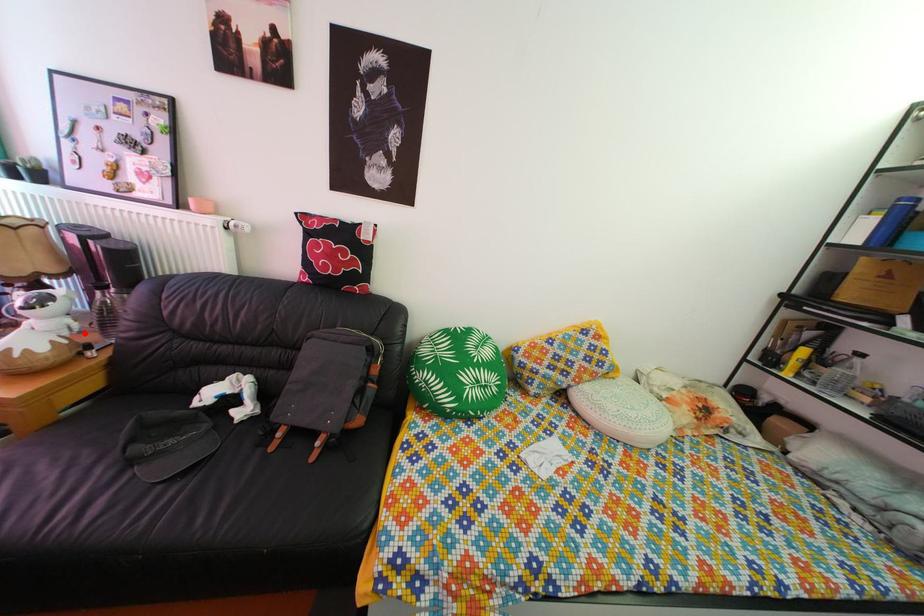
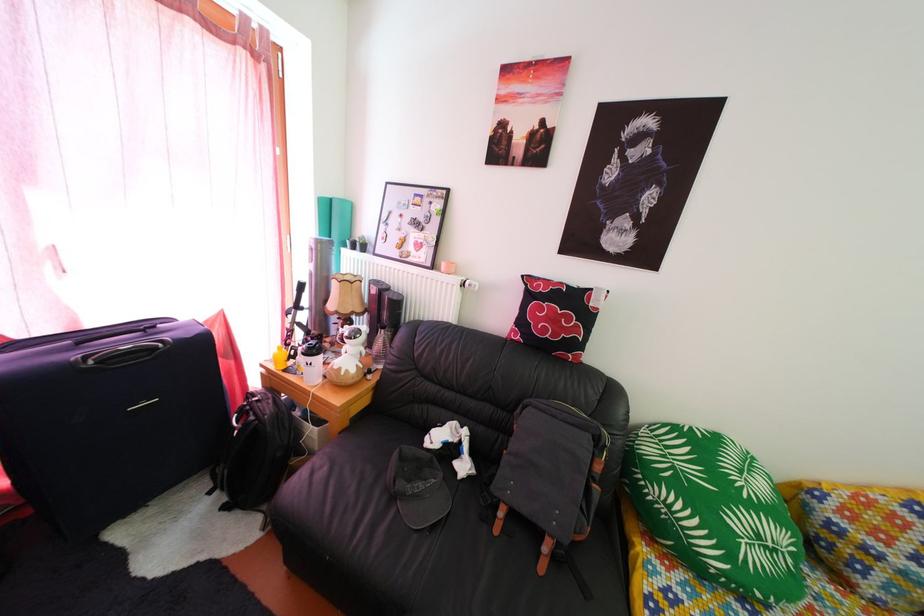
Question: I am providing you with two images of the same scene from different viewpoints. A red point is marked on the first image. Is the red point's position out of view in image 2?

Choices:
 (A) Yes
 (B) No

Answer: (B)